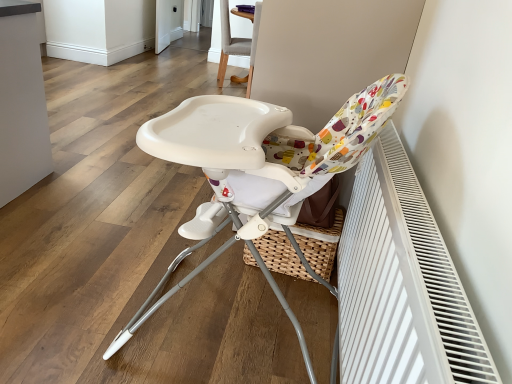
Question: Is white textured radiator at right at the left side of light gray fabric chair at upper center, the first chair viewed from the back?

Choices:
 (A) yes
 (B) no

Answer: (B)

Question: Does white textured radiator at right have a smaller size compared to light gray fabric chair at upper center, the first chair viewed from the back?

Choices:
 (A) yes
 (B) no

Answer: (A)

Question: From the image's perspective, does white textured radiator at right appear higher than light gray fabric chair at upper center, the first chair viewed from the back?

Choices:
 (A) no
 (B) yes

Answer: (A)

Question: Is white textured radiator at right wider than light gray fabric chair at upper center, which is the second chair from bottom to top?

Choices:
 (A) no
 (B) yes

Answer: (A)

Question: Is white textured radiator at right completely or partially outside of light gray fabric chair at upper center, the first chair viewed from the back?

Choices:
 (A) yes
 (B) no

Answer: (A)

Question: From the image's perspective, is white textured radiator at right above or below white plastic highchair at center, the first chair from the front?

Choices:
 (A) below
 (B) above

Answer: (A)

Question: Based on their positions, is white textured radiator at right located to the left or right of white plastic highchair at center, the first chair from the front?

Choices:
 (A) left
 (B) right

Answer: (B)

Question: Would you say white textured radiator at right is inside or outside white plastic highchair at center, the first chair from the front?

Choices:
 (A) outside
 (B) inside

Answer: (A)

Question: From a real-world perspective, is white textured radiator at right physically located above or below white plastic highchair at center, the first chair from the front?

Choices:
 (A) below
 (B) above

Answer: (A)

Question: Is white textured radiator at right in front of or behind white glossy screen door at upper center in the image?

Choices:
 (A) front
 (B) behind

Answer: (A)

Question: From a real-world perspective, is white textured radiator at right positioned above or below white glossy screen door at upper center?

Choices:
 (A) below
 (B) above

Answer: (B)

Question: Is point (368, 362) positioned closer to the camera than point (170, 13)?

Choices:
 (A) farther
 (B) closer

Answer: (B)

Question: From the image's perspective, is white textured radiator at right above or below white glossy screen door at upper center?

Choices:
 (A) below
 (B) above

Answer: (A)

Question: Is white plastic highchair at center, marked as the 1th chair in a bottom-to-top arrangement, to the left or to the right of white textured radiator at right in the image?

Choices:
 (A) left
 (B) right

Answer: (A)

Question: In terms of height, does white plastic highchair at center, which is counted as the second chair, starting from the back, look taller or shorter compared to white textured radiator at right?

Choices:
 (A) short
 (B) tall

Answer: (B)